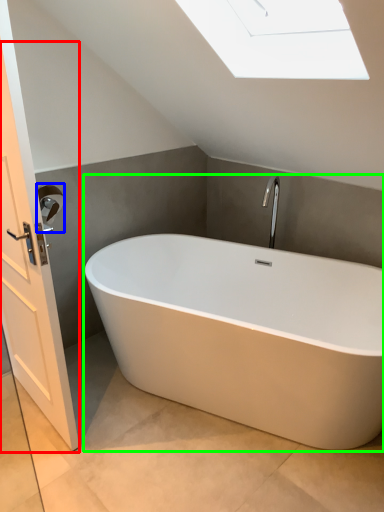
Question: Estimate the real-world distances between objects in this image. Which object is farther from screen door (highlighted by a red box), towel bar (highlighted by a blue box) or bathtub (highlighted by a green box)?

Choices:
 (A) towel bar
 (B) bathtub

Answer: (B)